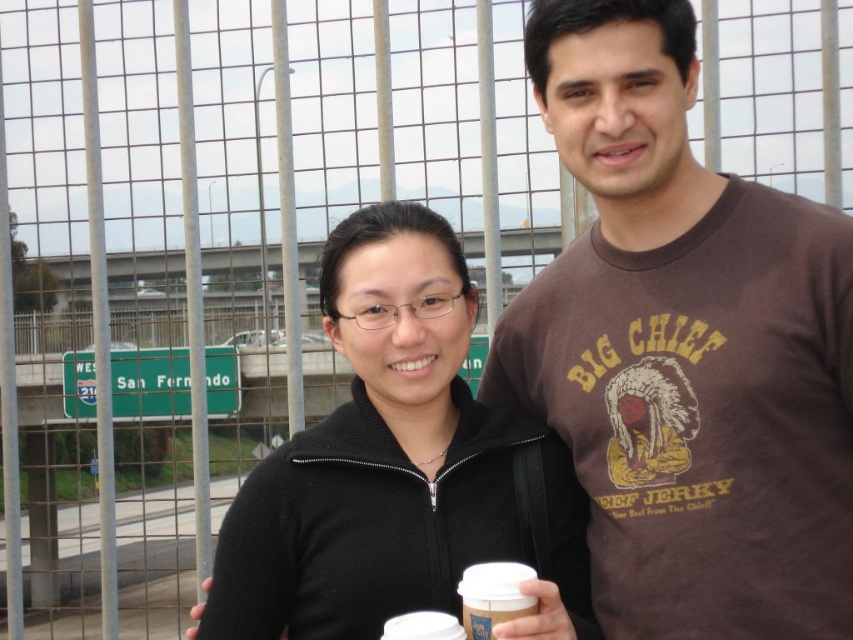
Is brown cotton t-shirt at center taller than white paper cup at center?

Yes.

Is brown cotton t-shirt at center further to the viewer compared to white paper cup at center?

Yes, brown cotton t-shirt at center is behind white paper cup at center.

Is point (759, 532) behind point (514, 579)?

Yes.

Identify the location of brown cotton t-shirt at center. (685, 349).

Which is in front, point (613, 179) or point (314, 512)?

Point (314, 512)

Find the location of a particular element. The width and height of the screenshot is (853, 640). brown cotton t-shirt at center is located at coordinates (685, 349).

Who is positioned more to the right, white paper cup at center or white paper cup at lower center?

white paper cup at lower center is more to the right.

Who is more forward, (474, 636) or (543, 596)?

Point (474, 636) is in front.

The image size is (853, 640). In order to click on white paper cup at center in this screenshot , I will do `click(492, 595)`.